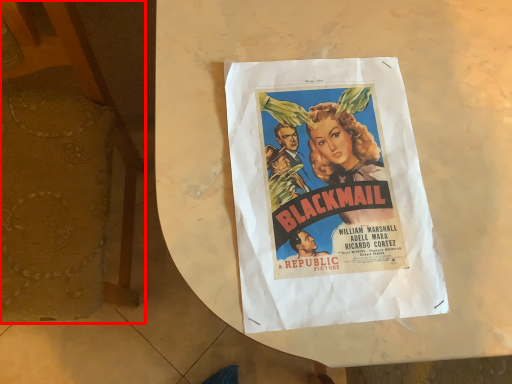
Question: Considering the relative positions of armchair (annotated by the red box) and poster in the image provided, where is armchair (annotated by the red box) located with respect to the staircase?

Choices:
 (A) left
 (B) right

Answer: (A)